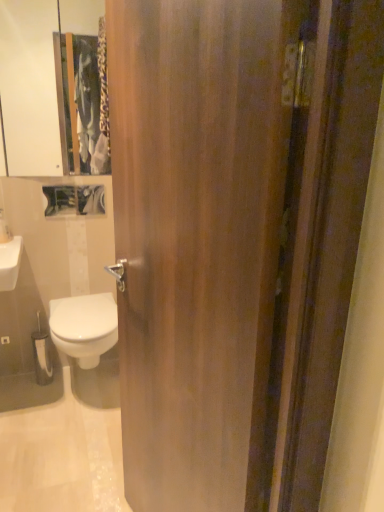
Question: Would you say white glossy medicine cabinet at upper left is part of white glossy soap dispenser at upper left's contents?

Choices:
 (A) yes
 (B) no

Answer: (B)

Question: From the image's perspective, does white glossy soap dispenser at upper left appear lower than white glossy medicine cabinet at upper left?

Choices:
 (A) no
 (B) yes

Answer: (B)

Question: Considering the relative sizes of white glossy soap dispenser at upper left and white glossy medicine cabinet at upper left in the image provided, is white glossy soap dispenser at upper left bigger than white glossy medicine cabinet at upper left?

Choices:
 (A) yes
 (B) no

Answer: (B)

Question: From a real-world perspective, is white glossy soap dispenser at upper left on top of white glossy medicine cabinet at upper left?

Choices:
 (A) yes
 (B) no

Answer: (B)

Question: Considering the relative sizes of white glossy soap dispenser at upper left and white glossy medicine cabinet at upper left in the image provided, is white glossy soap dispenser at upper left wider than white glossy medicine cabinet at upper left?

Choices:
 (A) no
 (B) yes

Answer: (B)

Question: Which is correct: white glossy soap dispenser at upper left is inside white glossy bidet at lower left, or outside of it?

Choices:
 (A) outside
 (B) inside

Answer: (A)

Question: From the image's perspective, is white glossy soap dispenser at upper left above or below white glossy bidet at lower left?

Choices:
 (A) above
 (B) below

Answer: (A)

Question: Looking at the image, does white glossy soap dispenser at upper left seem bigger or smaller compared to white glossy bidet at lower left?

Choices:
 (A) small
 (B) big

Answer: (A)

Question: Is point (1, 210) positioned closer to the camera than point (82, 327)?

Choices:
 (A) farther
 (B) closer

Answer: (A)

Question: From a real-world perspective, relative to wooden door at center, is white glossy medicine cabinet at upper left vertically above or below?

Choices:
 (A) above
 (B) below

Answer: (A)

Question: Is point (24, 90) closer or farther from the camera than point (228, 119)?

Choices:
 (A) closer
 (B) farther

Answer: (B)

Question: Based on their sizes in the image, would you say white glossy medicine cabinet at upper left is bigger or smaller than wooden door at center?

Choices:
 (A) big
 (B) small

Answer: (B)

Question: From the image's perspective, relative to wooden door at center, is white glossy medicine cabinet at upper left above or below?

Choices:
 (A) above
 (B) below

Answer: (A)

Question: Is wooden door at center inside the boundaries of white glossy bidet at lower left, or outside?

Choices:
 (A) inside
 (B) outside

Answer: (B)

Question: In the image, is wooden door at center positioned in front of or behind white glossy bidet at lower left?

Choices:
 (A) behind
 (B) front

Answer: (B)